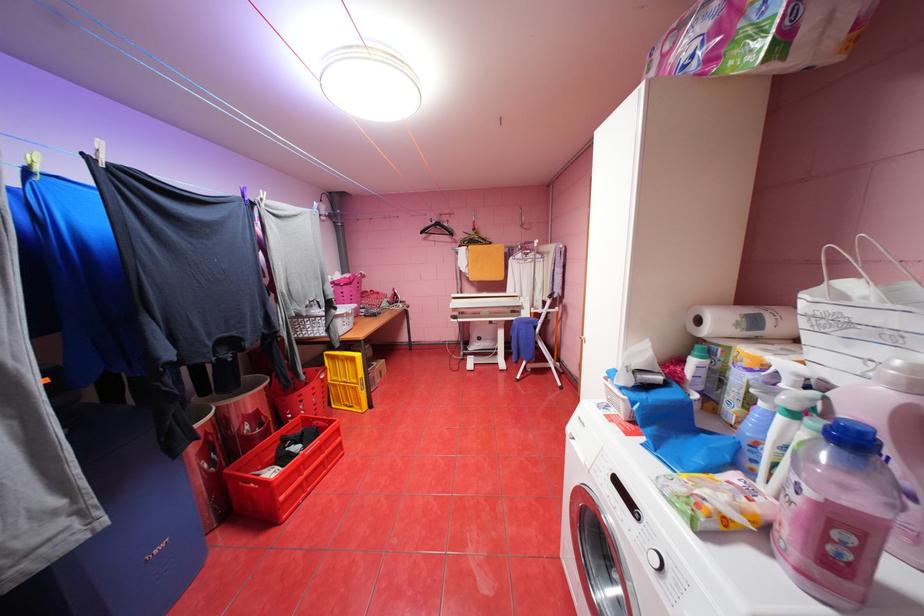
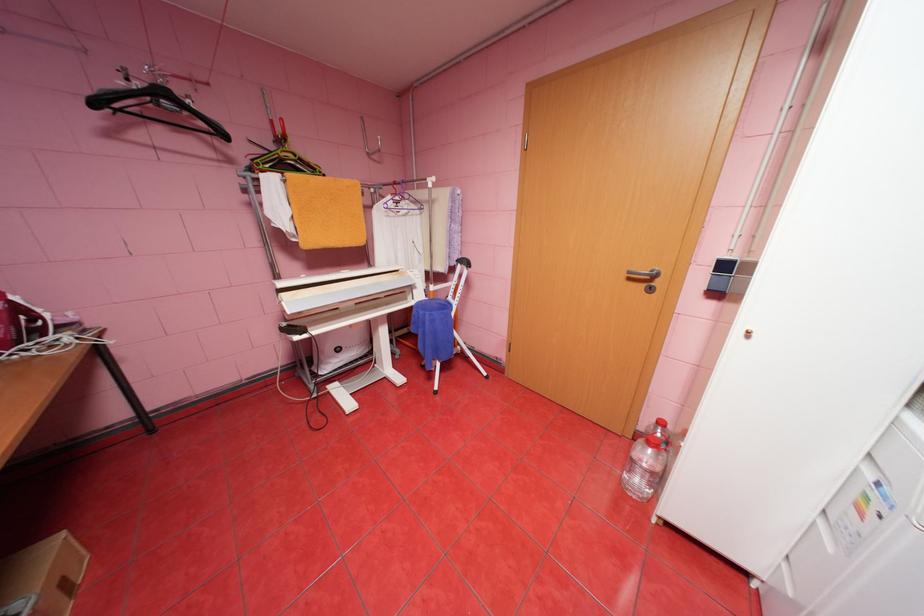
In the second image, find the point that corresponds to (x=431, y=232) in the first image.

(103, 103)